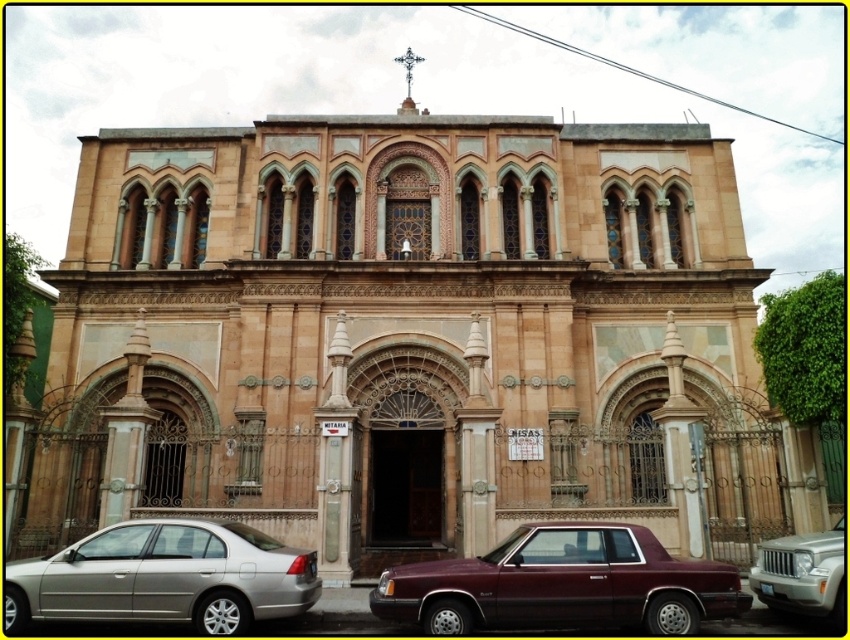
You are a visitor arriving at the grand building. You see a maroon metallic car at center and a silver metallic suv at lower right. From your perspective, which vehicle is positioned to the left?

The maroon metallic car at center is positioned to the left of the silver metallic suv at lower right.

You are a visitor arriving at the grand building and need to park your car. You see a silver metallic sedan at lower left and a silver metallic suv at lower right. Which parking spot is closer to the central entrance of the building?

The silver metallic sedan at lower left is closer to the central entrance because it is positioned on the left side of the silver metallic suv at lower right, and the central entrance is located in the middle of the building.

You are a pedestrian standing in front of the grand building. You see the maroon metallic car at center and the silver metallic sedan at lower left. Which car is closer to you?

The maroon metallic car at center is closer to you because it is in front of the silver metallic sedan at lower left.